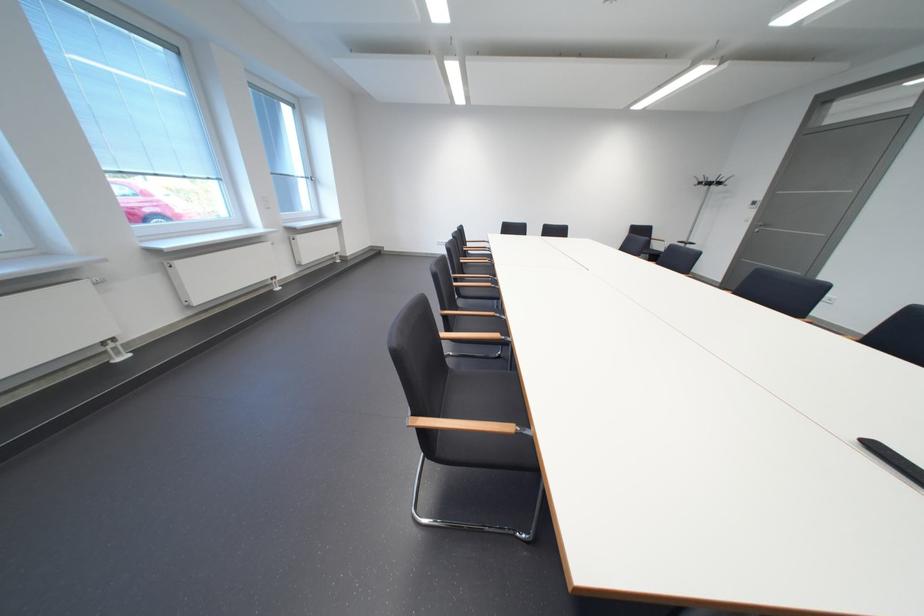
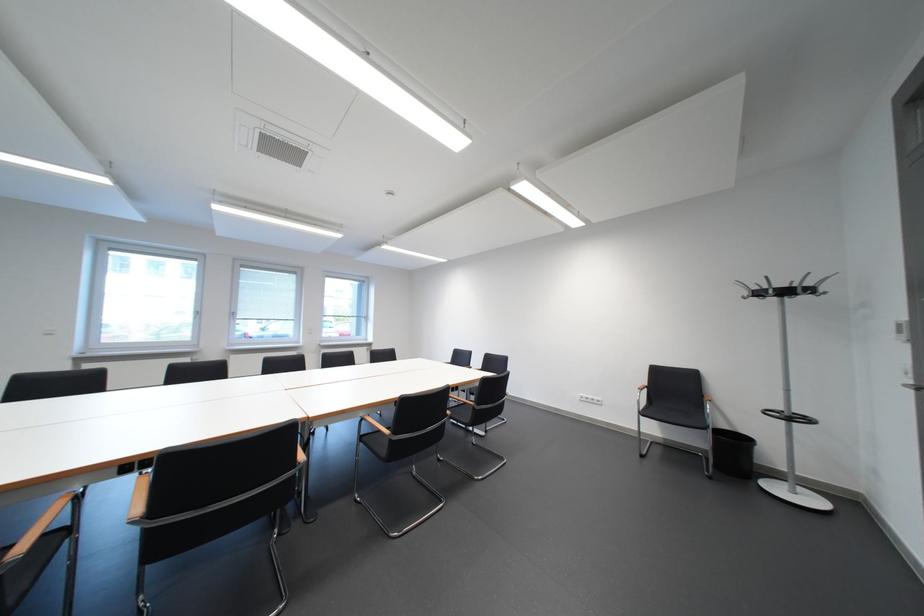
Where in the second image is the point corresponding to the point at 736,185 from the first image?

(823, 292)